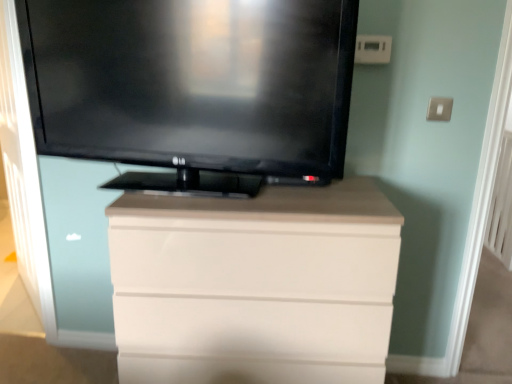
Find the location of `black glossy tv at upper center`. black glossy tv at upper center is located at coordinates (193, 87).

This screenshot has height=384, width=512. What do you see at coordinates (193, 87) in the screenshot?
I see `black glossy tv at upper center` at bounding box center [193, 87].

What is the approximate width of white glossy chest of drawers at center?

The width of white glossy chest of drawers at center is 50.52 centimeters.

This screenshot has height=384, width=512. Find the location of `white glossy chest of drawers at center`. white glossy chest of drawers at center is located at coordinates (255, 285).

Measure the distance between white glossy chest of drawers at center and camera.

They are 1.14 meters apart.

Describe the element at coordinates (255, 285) in the screenshot. I see `white glossy chest of drawers at center` at that location.

The image size is (512, 384). What are the coordinates of `black glossy tv at upper center` in the screenshot? It's located at (193, 87).

Is black glossy tv at upper center to the left of white glossy chest of drawers at center from the viewer's perspective?

Yes.

Between black glossy tv at upper center and white glossy chest of drawers at center, which one is positioned in front?

black glossy tv at upper center.

Considering the points (75, 67) and (134, 285), which point is behind, point (75, 67) or point (134, 285)?

The point (75, 67) is behind.

From the image's perspective, would you say black glossy tv at upper center is positioned over white glossy chest of drawers at center?

Yes.

From a real-world perspective, relative to white glossy chest of drawers at center, is black glossy tv at upper center vertically above or below?

black glossy tv at upper center is situated higher than white glossy chest of drawers at center in the real world.

Between black glossy tv at upper center and white glossy chest of drawers at center, which one has smaller width?

With smaller width is black glossy tv at upper center.

Considering the sizes of objects black glossy tv at upper center and white glossy chest of drawers at center in the image provided, who is taller, black glossy tv at upper center or white glossy chest of drawers at center?

With more height is white glossy chest of drawers at center.

Considering the sizes of black glossy tv at upper center and white glossy chest of drawers at center in the image, is black glossy tv at upper center bigger or smaller than white glossy chest of drawers at center?

Considering their sizes, black glossy tv at upper center takes up less space than white glossy chest of drawers at center.

Would you say black glossy tv at upper center contains white glossy chest of drawers at center?

No, black glossy tv at upper center does not contain white glossy chest of drawers at center.

Would you consider black glossy tv at upper center to be distant from white glossy chest of drawers at center?

A: No, black glossy tv at upper center is in close proximity to white glossy chest of drawers at center.

Is black glossy tv at upper center oriented towards white glossy chest of drawers at center?

No, black glossy tv at upper center does not turn towards white glossy chest of drawers at center.

Can you tell me how much black glossy tv at upper center and white glossy chest of drawers at center differ in facing direction?

black glossy tv at upper center and white glossy chest of drawers at center are facing 7.81 degrees away from each other.

Find the location of a particular element. The image size is (512, 384). television in front of the white glossy chest of drawers at center is located at coordinates (193, 87).

Between white glossy chest of drawers at center and black glossy tv at upper center, which one appears on the left side from the viewer's perspective?

black glossy tv at upper center is more to the left.

Which object is more forward, white glossy chest of drawers at center or black glossy tv at upper center?

Positioned in front is black glossy tv at upper center.

Considering the points (194, 353) and (114, 60), which point is in front, point (194, 353) or point (114, 60)?

Point (194, 353)

From the image's perspective, is white glossy chest of drawers at center on top of black glossy tv at upper center?

No, from the image's perspective, white glossy chest of drawers at center is not above black glossy tv at upper center.

From a real-world perspective, is white glossy chest of drawers at center physically located above or below black glossy tv at upper center?

white glossy chest of drawers at center is situated lower than black glossy tv at upper center in the real world.

Considering the relative sizes of white glossy chest of drawers at center and black glossy tv at upper center in the image provided, is white glossy chest of drawers at center wider than black glossy tv at upper center?

Correct, the width of white glossy chest of drawers at center exceeds that of black glossy tv at upper center.

Is white glossy chest of drawers at center shorter than black glossy tv at upper center?

No, white glossy chest of drawers at center is not shorter than black glossy tv at upper center.

Can you confirm if white glossy chest of drawers at center is bigger than black glossy tv at upper center?

Yes, white glossy chest of drawers at center is bigger than black glossy tv at upper center.

Is white glossy chest of drawers at center inside the boundaries of black glossy tv at upper center, or outside?

white glossy chest of drawers at center lies outside black glossy tv at upper center.

Is there a large distance between white glossy chest of drawers at center and black glossy tv at upper center?

No.

Is black glossy tv at upper center at the back of white glossy chest of drawers at center?

white glossy chest of drawers at center does not have its back to black glossy tv at upper center.

I want to click on the chest of drawers that is behind the black glossy tv at upper center, so 255,285.

Where is `television on the left of white glossy chest of drawers at center`? television on the left of white glossy chest of drawers at center is located at coordinates (193, 87).

I want to click on the chest of drawers directly beneath the black glossy tv at upper center (from a real-world perspective), so click(255, 285).